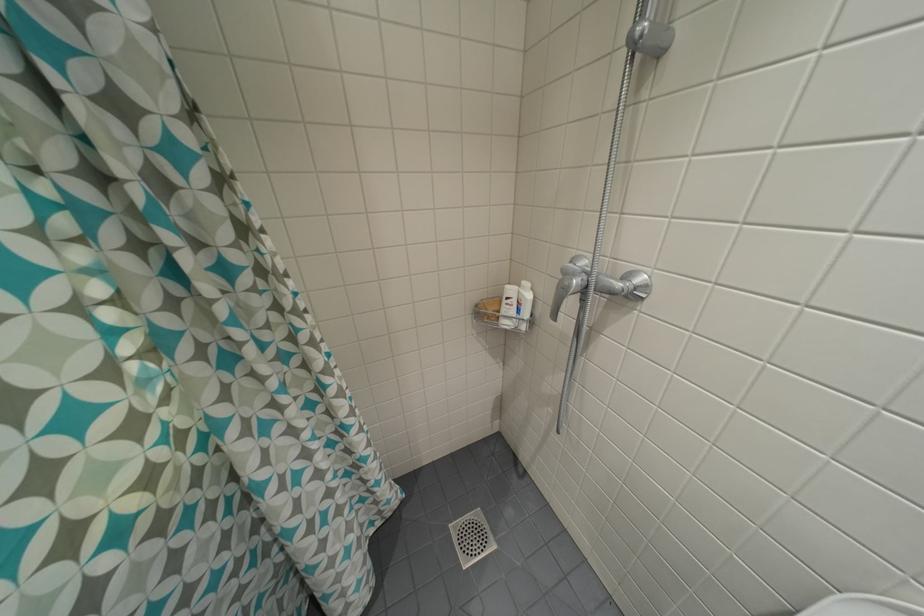
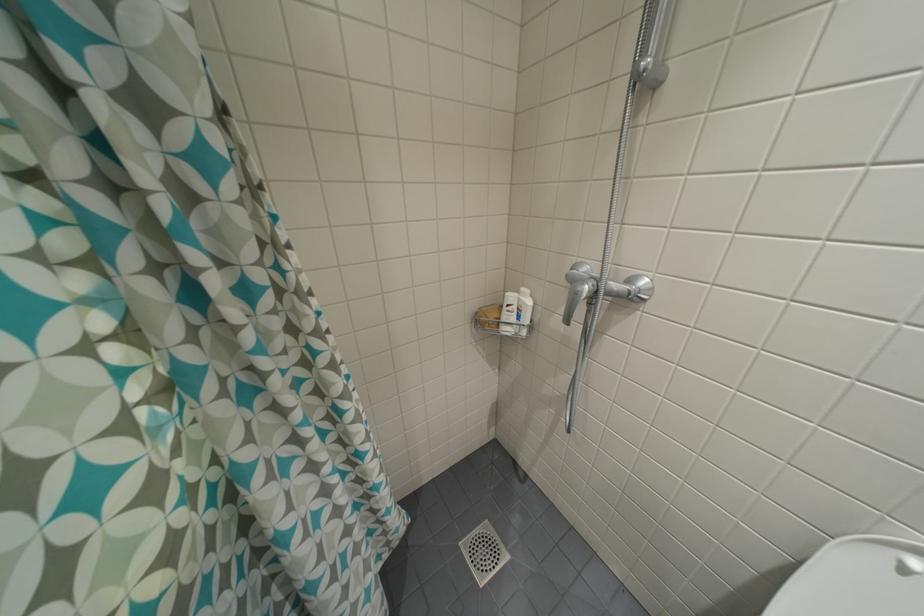
Question: Based on the continuous images, in which direction is the camera rotating? Reply with the corresponding letter.

Choices:
 (A) Left
 (B) Right
 (C) Up
 (D) Down

Answer: (B)